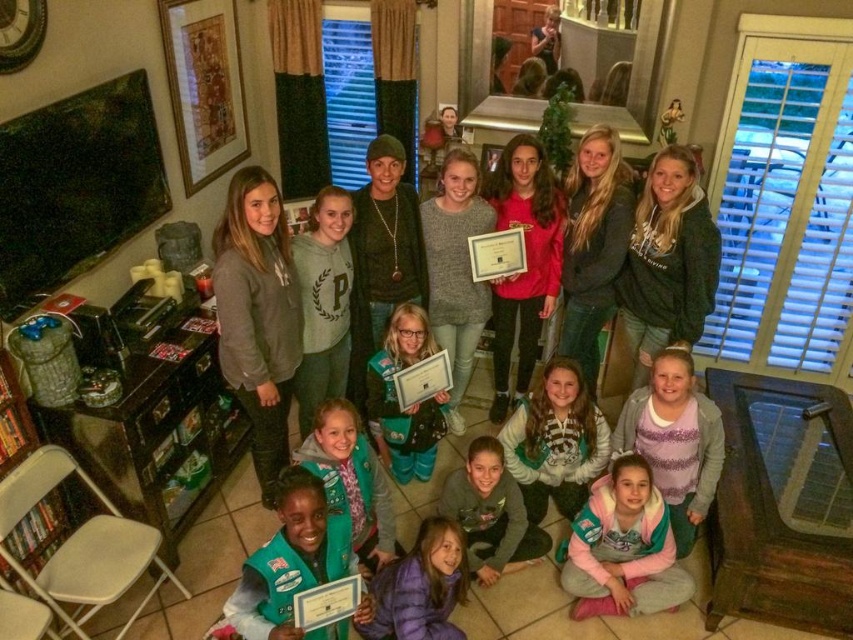
You are a photographer standing in the corner of the room. You need to take a photo of both the pink fleece jacket at lower center and the purple down jacket at lower center. Given that your camera can capture a maximum distance of 30 inches between objects in focus, will both jackets be in focus in the same shot?

The distance between the pink fleece jacket at lower center and the purple down jacket at lower center is 28.42 inches, which is within the camera maximum focus distance of 30 inches. Therefore, both jackets will be in focus in the same shot.

You are a photographer positioned at the entrance of the room. You need to take a photo that includes both the pink fleece jacket at lower center and the green fleece vest at center. Which one of these items will appear larger in the photo?

The pink fleece jacket at lower center will appear larger in the photo because it is closer to the viewer than the green fleece vest at center.